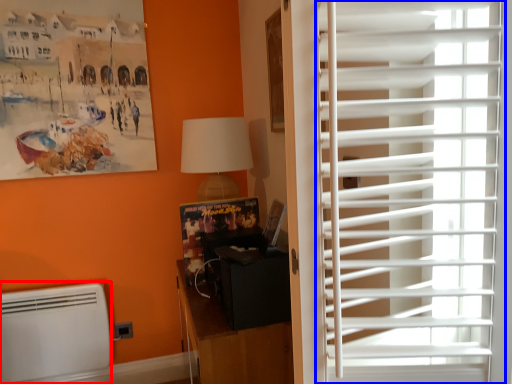
Question: Which object is further to the camera taking this photo, air conditioning (highlighted by a red box) or window blind (highlighted by a blue box)?

Choices:
 (A) air conditioning
 (B) window blind

Answer: (A)